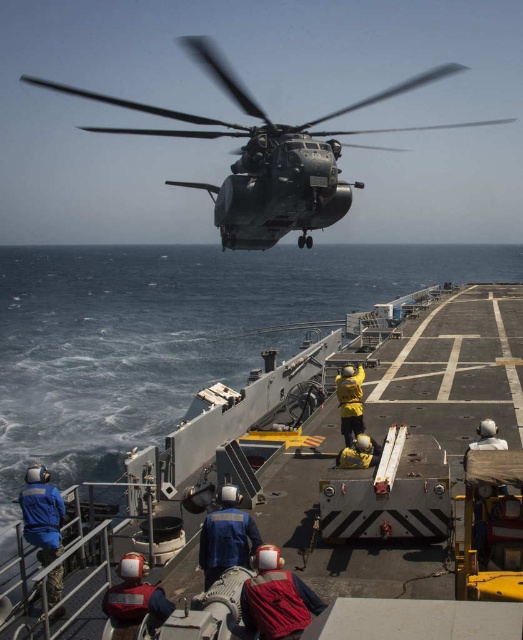
Question: Which point is farther to the camera?

Choices:
 (A) (36, 518)
 (B) (287, 579)
 (C) (345, 448)

Answer: (C)

Question: Does dark gray metallic helicopter at upper center appear on the right side of blue fabric sailor at center?

Choices:
 (A) no
 (B) yes

Answer: (A)

Question: Among these points, which one is farthest from the camera?

Choices:
 (A) (32, 470)
 (B) (345, 422)
 (C) (299, 625)

Answer: (B)

Question: Is metallic gray boat at center below dark gray metallic helicopter at upper center?

Choices:
 (A) no
 (B) yes

Answer: (B)

Question: Among these points, which one is farthest from the camera?

Choices:
 (A) (323, 180)
 (B) (345, 467)
 (C) (355, 376)

Answer: (A)

Question: Does blue fabric sailor at center appear under yellow matte helmet at center?

Choices:
 (A) no
 (B) yes

Answer: (B)